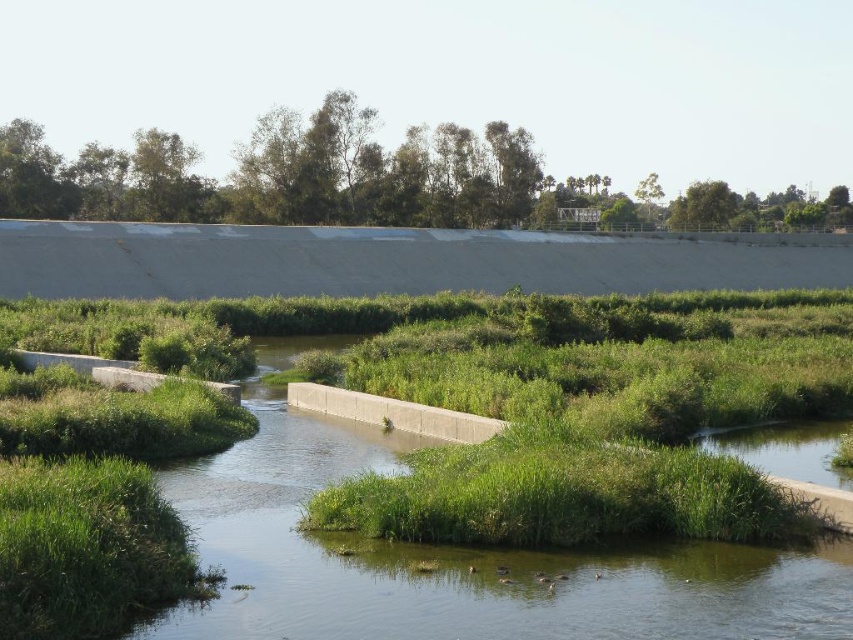
Is green grassy river at center below green leafy trees at upper center?

Yes, green grassy river at center is below green leafy trees at upper center.

Does green grassy river at center have a larger size compared to green leafy trees at upper center?

Actually, green grassy river at center might be smaller than green leafy trees at upper center.

Measure the distance between green grassy river at center and camera.

green grassy river at center is 47.14 feet away from camera.

In order to click on green grassy river at center in this screenshot , I will do `click(456, 561)`.